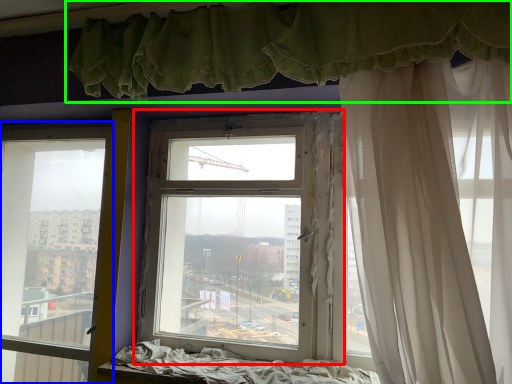
Question: Which is farther away from window (highlighted by a red box)? window (highlighted by a blue box) or curtain (highlighted by a green box)?

Choices:
 (A) window
 (B) curtain

Answer: (A)